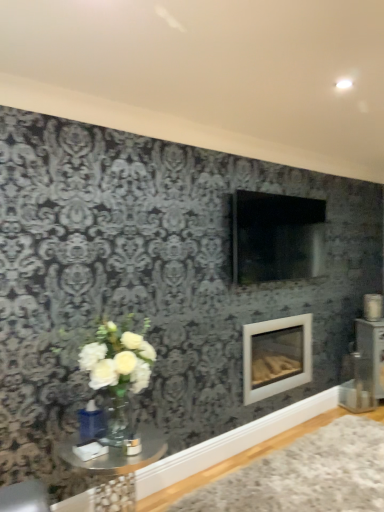
You are a GUI agent. You are given a task and a screenshot of the screen. Output one action in this format:
    pyautogui.click(x=<x>, y=<y>)
    Task: Click on the blank space above white plush rug at lower right (from a real-world perspective)
    
    Given the screenshot: What is the action you would take?
    pyautogui.click(x=310, y=479)